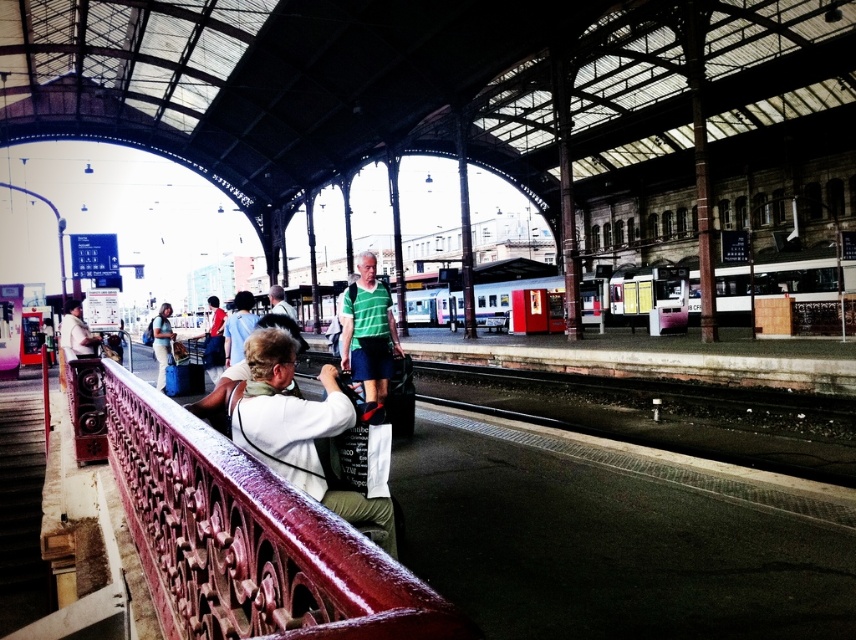
You are standing on the train station platform and notice two people wearing the matte white shirt at left and the green fabric shirt at center. From your perspective, which person is positioned lower in the image?

The matte white shirt at left is located below the green fabric shirt at center, so the person wearing the matte white shirt at left is positioned lower in the image.